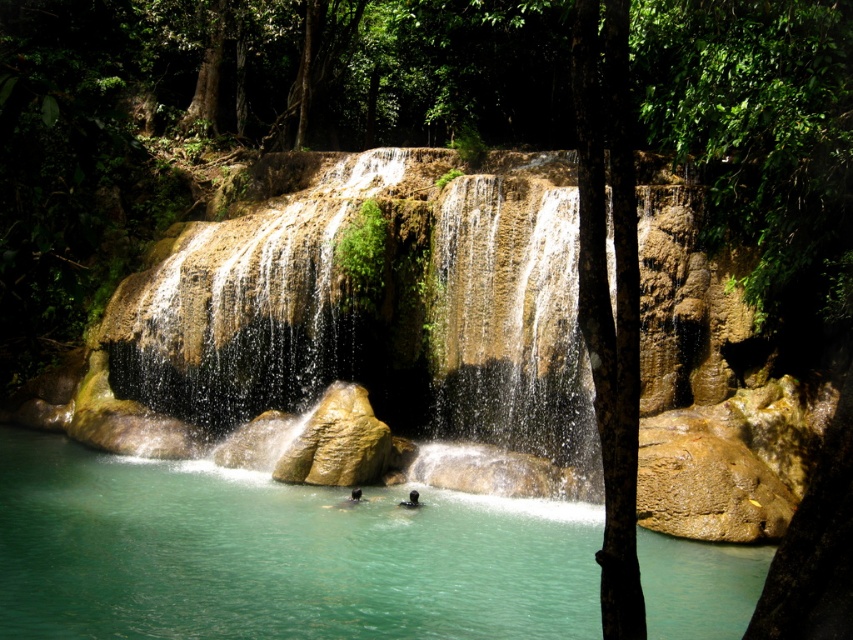
Measure the distance between point (x=35, y=496) and camera.

They are 74.56 feet apart.

Between point (126, 616) and point (514, 385), which one is positioned behind?

Point (514, 385)

Between point (538, 582) and point (386, 346), which one is positioned in front?

Positioned in front is point (538, 582).

You are a GUI agent. You are given a task and a screenshot of the screen. Output one action in this format:
    pyautogui.click(x=<x>, y=<y>)
    Task: Click on the clear turquoise water at center
    
    Given the screenshot: What is the action you would take?
    pyautogui.click(x=276, y=554)

Does clear turquoise water at center appear under black matte person at center?

Yes, clear turquoise water at center is below black matte person at center.

Is point (390, 636) positioned behind point (399, 500)?

No, it is in front of (399, 500).

Describe the element at coordinates (276, 554) in the screenshot. I see `clear turquoise water at center` at that location.

The height and width of the screenshot is (640, 853). What are the coordinates of `clear turquoise water at center` in the screenshot? It's located at click(276, 554).

Does smooth skin person at lower center appear on the left side of black matte person at center?

Indeed, smooth skin person at lower center is positioned on the left side of black matte person at center.

Between smooth skin person at lower center and black matte person at center, which one is positioned lower?

black matte person at center is lower down.

Which is in front, point (337, 506) or point (407, 500)?

Point (337, 506) is in front.

Identify the location of smooth skin person at lower center. Image resolution: width=853 pixels, height=640 pixels. (351, 499).